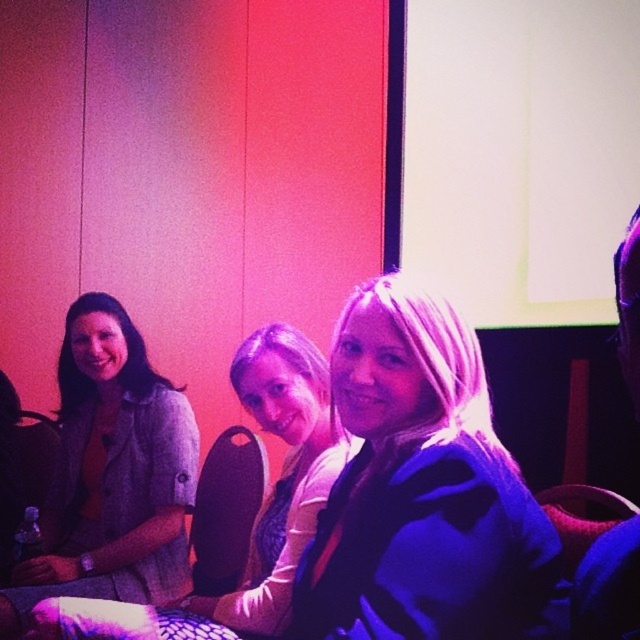
Between matte gray blazer at left and matte gray blazer at center, which one has less height?

Standing shorter between the two is matte gray blazer at center.

Which is behind, point (81, 545) or point (298, 484)?

Positioned behind is point (81, 545).

Does point (90, 596) come closer to viewer compared to point (237, 378)?

No, it is behind (237, 378).

Identify the location of matte gray blazer at left. The height and width of the screenshot is (640, 640). (112, 474).

What do you see at coordinates (424, 496) in the screenshot? I see `satin blue dress at center` at bounding box center [424, 496].

Between point (504, 468) and point (52, 481), which one is positioned behind?

Point (52, 481)

This screenshot has height=640, width=640. What are the coordinates of `satin blue dress at center` in the screenshot? It's located at (424, 496).

Which is behind, point (403, 589) or point (317, 394)?

Positioned behind is point (317, 394).

Is satin blue dress at center positioned at the back of matte gray blazer at center?

No, satin blue dress at center is closer to the viewer.

Which is behind, point (333, 557) or point (280, 432)?

Point (280, 432)

Where is `satin blue dress at center`? Image resolution: width=640 pixels, height=640 pixels. satin blue dress at center is located at coordinates (424, 496).